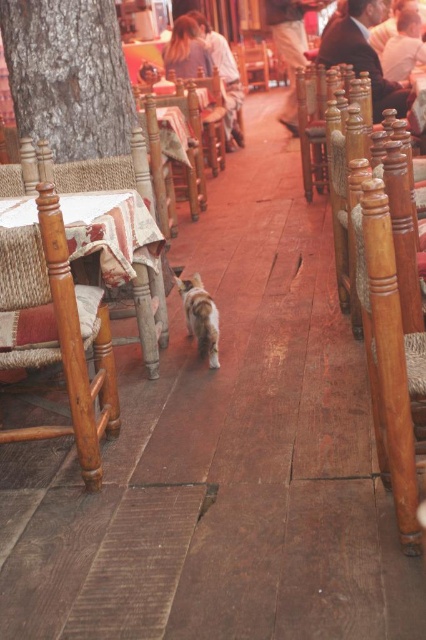
You are a customer in this cozy, rustic indoor setting. You need to place your dark brown leather jacket at upper right on the wooden chair at center. Can you do that without the jacket falling off?

The dark brown leather jacket at upper right is bigger than wooden chair at center, so placing it on the wooden chair at center may cause the jacket to fall off due to its larger size.

In the scene shown: You are a customer entering the restaurant and see the dark brown leather jacket at upper right and the wooden chair at center. Which object is wider?

The dark brown leather jacket at upper right is wider than the wooden chair at center because its width surpasses the chair.

You are a customer entering the restaurant and see the dark brown leather jacket at upper right and the wooden chair at center. Which object is shorter in height?

The dark brown leather jacket at upper right is shorter than the wooden chair at center because it is not as tall as the wooden chair at center.